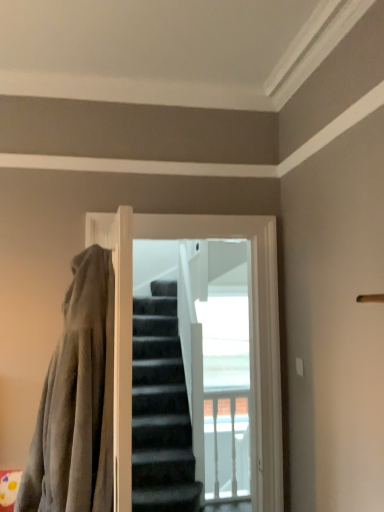
Question: Is dark gray carpeted stairs at center inside the boundaries of velvety gray blanket at left, or outside?

Choices:
 (A) outside
 (B) inside

Answer: (A)

Question: In terms of width, does dark gray carpeted stairs at center look wider or thinner when compared to velvety gray blanket at left?

Choices:
 (A) thin
 (B) wide

Answer: (A)

Question: From a real-world perspective, is dark gray carpeted stairs at center positioned above or below velvety gray blanket at left?

Choices:
 (A) above
 (B) below

Answer: (A)

Question: Is point (49, 492) closer or farther from the camera than point (228, 461)?

Choices:
 (A) closer
 (B) farther

Answer: (A)

Question: In the image, is velvety gray blanket at left positioned in front of or behind dark gray carpeted stairs at center?

Choices:
 (A) front
 (B) behind

Answer: (A)

Question: Visually, is velvety gray blanket at left positioned to the left or to the right of dark gray carpeted stairs at center?

Choices:
 (A) left
 (B) right

Answer: (A)

Question: Based on their sizes in the image, would you say velvety gray blanket at left is bigger or smaller than dark gray carpeted stairs at center?

Choices:
 (A) small
 (B) big

Answer: (B)